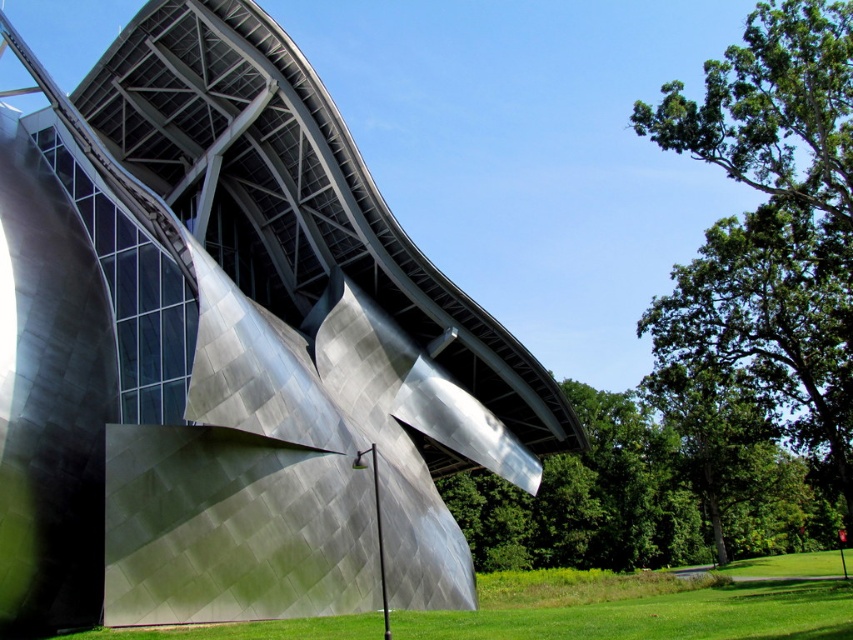
Question: Observing the image, what is the correct spatial positioning of metallic silver building at center in reference to green grass at lower center?

Choices:
 (A) above
 (B) below

Answer: (A)

Question: Does metallic silver building at center have a smaller size compared to green grass at lower center?

Choices:
 (A) yes
 (B) no

Answer: (A)

Question: Which of the following is the closest to the observer?

Choices:
 (A) green grass at lower center
 (B) metallic silver building at center

Answer: (A)

Question: Does metallic silver building at center have a greater width compared to green grass at lower center?

Choices:
 (A) no
 (B) yes

Answer: (A)